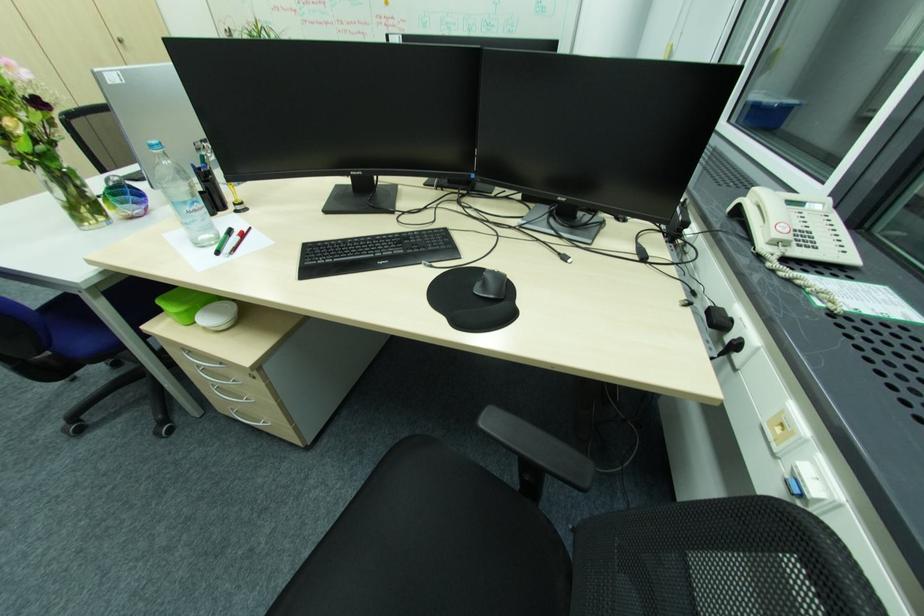
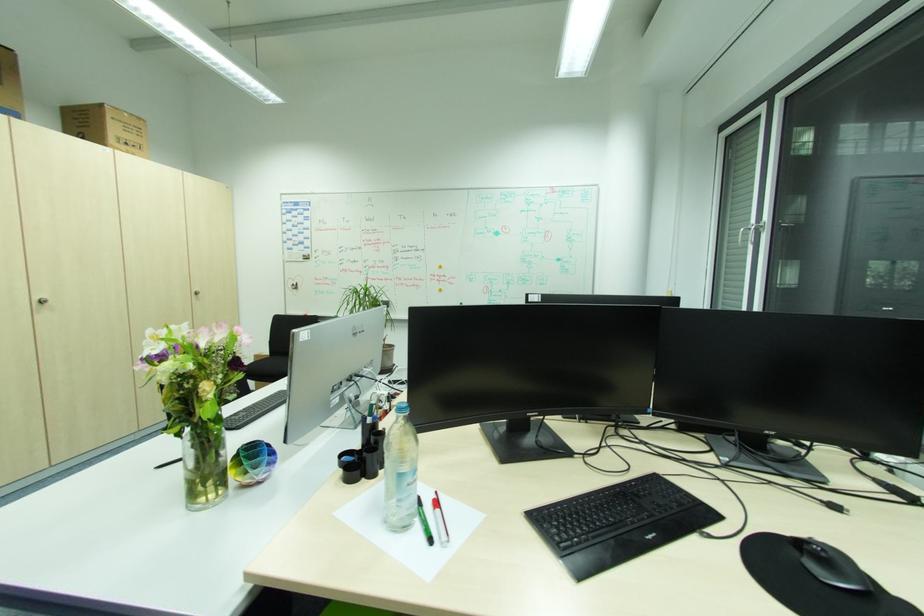
Locate, in the second image, the point that corresponds to the point at 126,41 in the first image.

(202, 293)